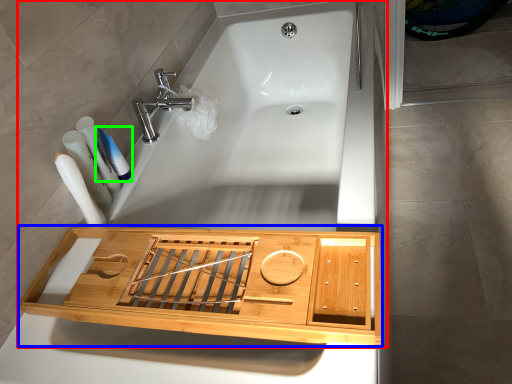
Question: Based on their relative distances, which object is farther from bath (highlighted by a red box)? Choose from cabinetry (highlighted by a blue box) and toothpaste (highlighted by a green box).

Choices:
 (A) cabinetry
 (B) toothpaste

Answer: (B)